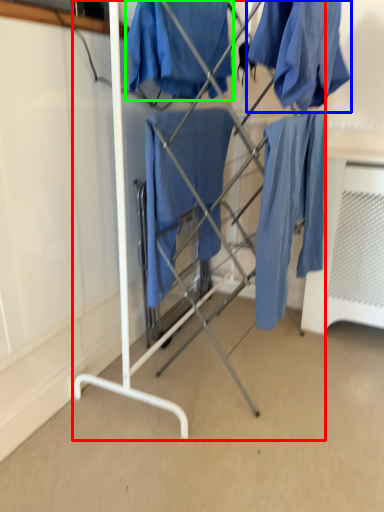
Question: Considering the real-world distances, which object is farthest from furniture (highlighted by a red box)? clothing (highlighted by a blue box) or clothing (highlighted by a green box)?

Choices:
 (A) clothing
 (B) clothing

Answer: (A)